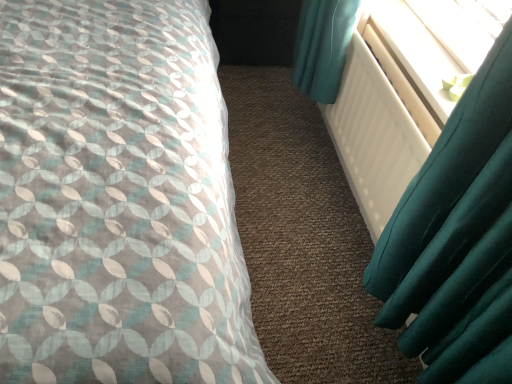
Question: Does white matte radiator at right come behind patterned fabric bed at left?

Choices:
 (A) no
 (B) yes

Answer: (B)

Question: From the image's perspective, is white matte radiator at right located above patterned fabric bed at left?

Choices:
 (A) no
 (B) yes

Answer: (A)

Question: Is white matte radiator at right bigger than patterned fabric bed at left?

Choices:
 (A) no
 (B) yes

Answer: (A)

Question: Is white matte radiator at right positioned with its back to patterned fabric bed at left?

Choices:
 (A) yes
 (B) no

Answer: (B)

Question: Does white matte radiator at right appear on the right side of patterned fabric bed at left?

Choices:
 (A) no
 (B) yes

Answer: (B)

Question: Is white matte radiator at right facing towards patterned fabric bed at left?

Choices:
 (A) yes
 (B) no

Answer: (A)

Question: Could you tell me if white plastic radiator at upper right is turned towards patterned fabric bed at left?

Choices:
 (A) no
 (B) yes

Answer: (B)

Question: Is white plastic radiator at upper right at the right side of patterned fabric bed at left?

Choices:
 (A) yes
 (B) no

Answer: (A)

Question: Is white plastic radiator at upper right positioned beyond the bounds of patterned fabric bed at left?

Choices:
 (A) no
 (B) yes

Answer: (B)

Question: From the image's perspective, does white plastic radiator at upper right appear higher than patterned fabric bed at left?

Choices:
 (A) yes
 (B) no

Answer: (A)

Question: Is white plastic radiator at upper right taller than patterned fabric bed at left?

Choices:
 (A) no
 (B) yes

Answer: (A)

Question: Is white plastic radiator at upper right bigger than patterned fabric bed at left?

Choices:
 (A) no
 (B) yes

Answer: (A)

Question: Is white plastic radiator at upper right far from white matte radiator at right?

Choices:
 (A) no
 (B) yes

Answer: (A)